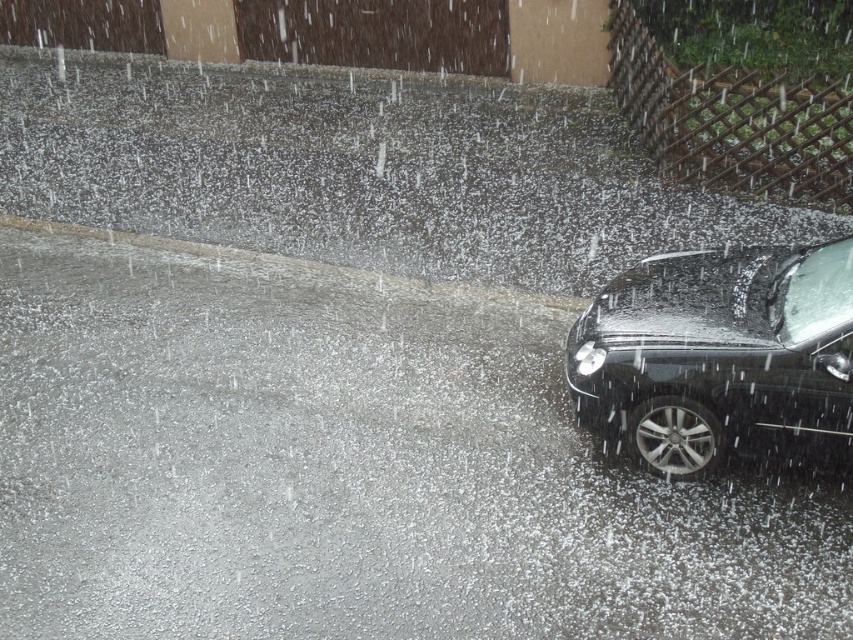
Question: Is glossy black car at right further to the viewer compared to gray concrete curb at lower left?

Choices:
 (A) no
 (B) yes

Answer: (A)

Question: Which object appears farthest from the camera in this image?

Choices:
 (A) gray concrete curb at lower left
 (B) glossy black car at right

Answer: (A)

Question: Which point appears closest to the camera in this image?

Choices:
 (A) (849, 276)
 (B) (242, 272)

Answer: (A)

Question: Among these objects, which one is farthest from the camera?

Choices:
 (A) glossy black car at right
 (B) gray concrete curb at lower left

Answer: (B)

Question: Can you confirm if glossy black car at right is thinner than gray concrete curb at lower left?

Choices:
 (A) yes
 (B) no

Answer: (A)

Question: Is glossy black car at right smaller than gray concrete curb at lower left?

Choices:
 (A) no
 (B) yes

Answer: (B)